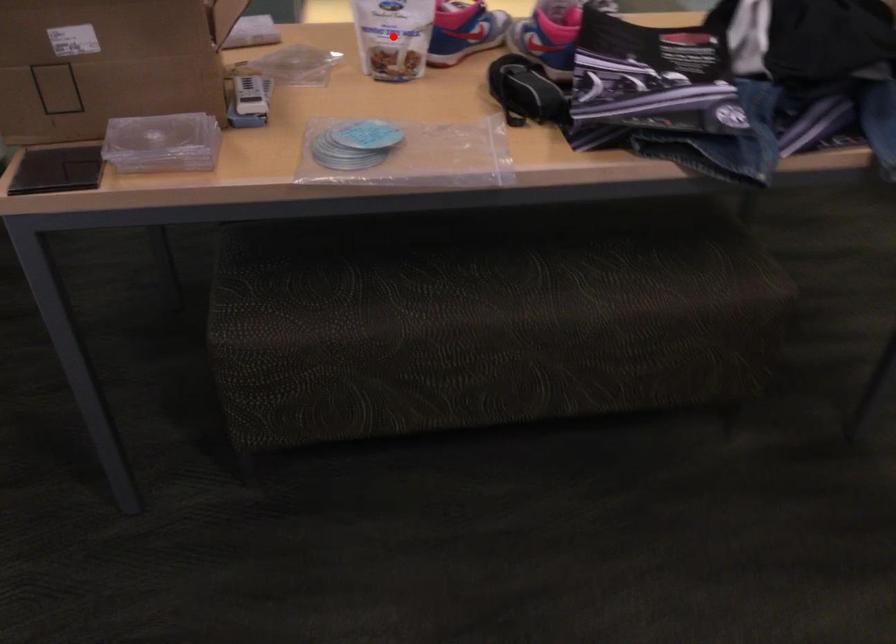
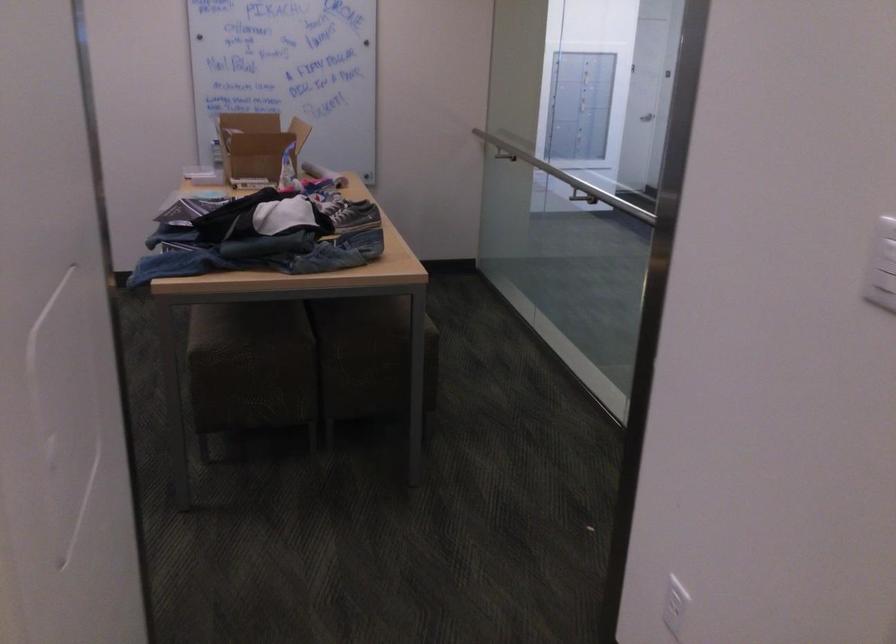
Question: I am providing you with two images of the same scene from different viewpoints. A red point is marked on the first image. Can you still see the location of the red point in image 2?

Choices:
 (A) Yes
 (B) No

Answer: (B)